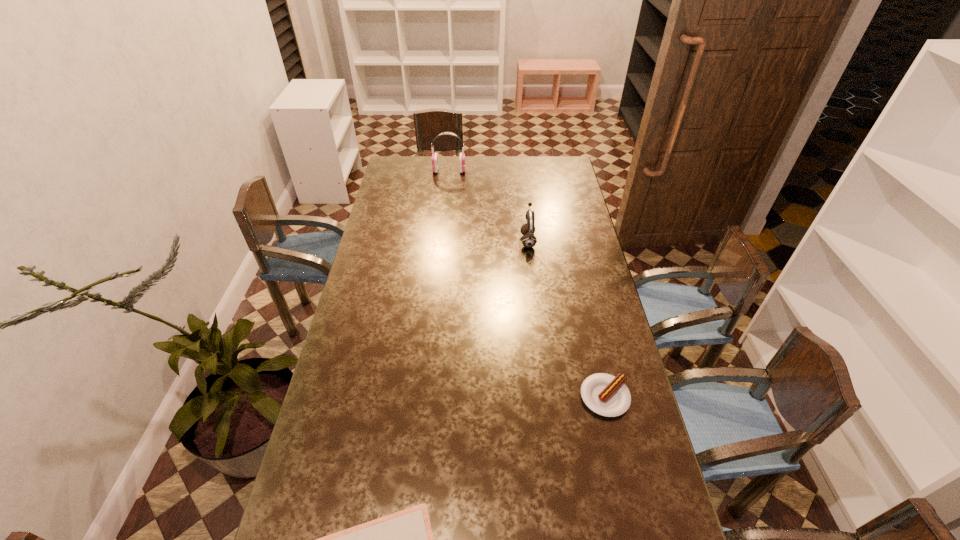
The width and height of the screenshot is (960, 540). In order to click on the tallest object in this screenshot , I will do `click(434, 159)`.

At what (x,y) coordinates should I click in order to perform the action: click on the farthest object. Please return your answer as a coordinate pair (x, y). The image size is (960, 540). Looking at the image, I should click on (434, 159).

I want to click on the second object from right to left, so click(529, 240).

Locate an element on the screen. the shorter earphone is located at coordinates (529, 240).

The height and width of the screenshot is (540, 960). I want to click on the second nearest object, so click(606, 395).

Locate an element on the screen. The image size is (960, 540). the third tallest object is located at coordinates (606, 395).

Identify the location of vacant area situated 0.360m on the outer surface of the tallest object. (536, 171).

Locate an element on the screen. The image size is (960, 540). free space located on the ear pads of the second tallest object is located at coordinates (455, 240).

This screenshot has height=540, width=960. Identify the location of free space located on the ear pads of the second tallest object. (493, 240).

Identify the location of vacant space located on the ear pads of the second tallest object. (426, 240).